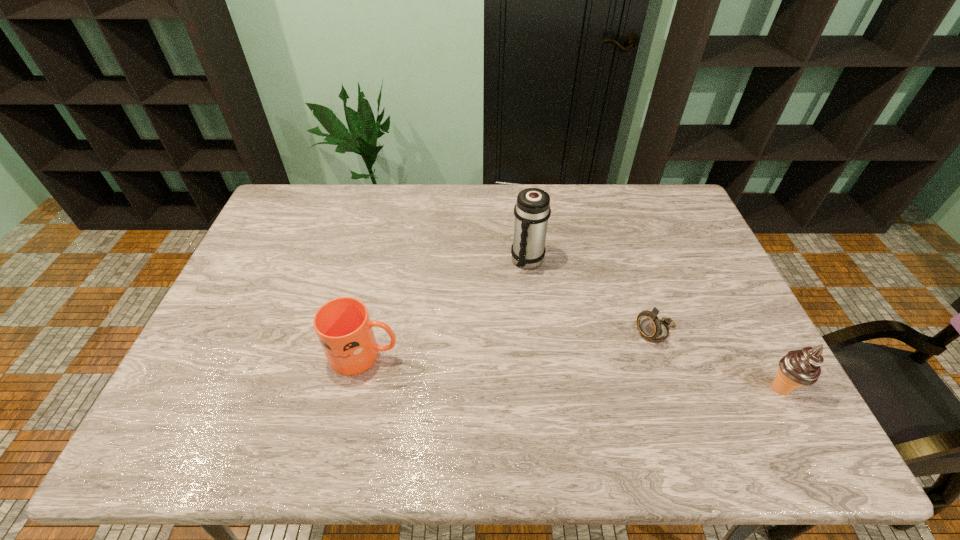
Where is `vacant space at the left edge of the desktop`? vacant space at the left edge of the desktop is located at coordinates (253, 317).

Identify the location of vacant area at the right edge. click(676, 269).

This screenshot has width=960, height=540. What are the coordinates of `vacant space at the far left corner of the desktop` in the screenshot? It's located at (296, 184).

Where is `free space between the mug and the compass`? The height and width of the screenshot is (540, 960). free space between the mug and the compass is located at coordinates (511, 344).

The image size is (960, 540). In order to click on vacant area that lies between the second object from right to left and the farthest object in this screenshot , I will do 591,297.

The height and width of the screenshot is (540, 960). Identify the location of vacant space in between the compass and the leftmost object. (511, 344).

You are a GUI agent. You are given a task and a screenshot of the screen. Output one action in this format:
    pyautogui.click(x=<x>, y=<y>)
    Task: Click on the unoccupied area between the mug and the thermos bottle
    The height and width of the screenshot is (540, 960).
    Given the screenshot: What is the action you would take?
    pyautogui.click(x=446, y=308)

At what (x,y) coordinates should I click in order to perform the action: click on vacant area between the compass and the mug. Please return your answer as a coordinate pair (x, y). The width and height of the screenshot is (960, 540). Looking at the image, I should click on pos(511,344).

This screenshot has height=540, width=960. In order to click on free space between the icecream and the second object from right to left in this screenshot , I will do `click(718, 361)`.

Select which object is the second closest to the icecream. Please provide its 2D coordinates. Your answer should be formatted as a tuple, i.e. [(x, y)], where the tuple contains the x and y coordinates of a point satisfying the conditions above.

[(532, 210)]